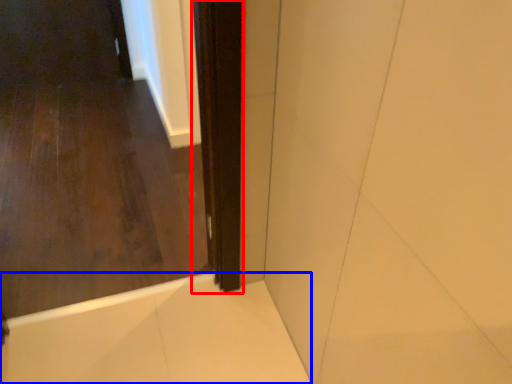
Question: Among these objects, which one is nearest to the camera, screen door (highlighted by a red box) or bath (highlighted by a blue box)?

Choices:
 (A) screen door
 (B) bath

Answer: (A)